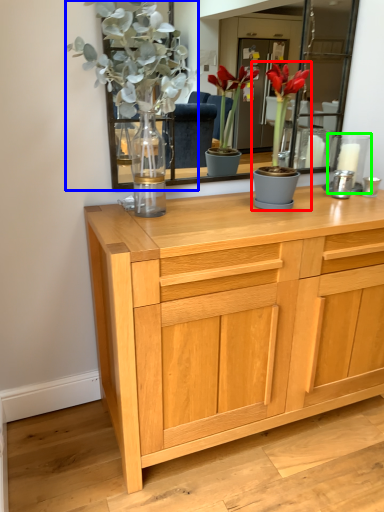
Question: Based on their relative distances, which object is nearer to houseplant (highlighted by a red box)? Choose from floral arrangement (highlighted by a blue box) and candle holder (highlighted by a green box).

Choices:
 (A) floral arrangement
 (B) candle holder

Answer: (B)